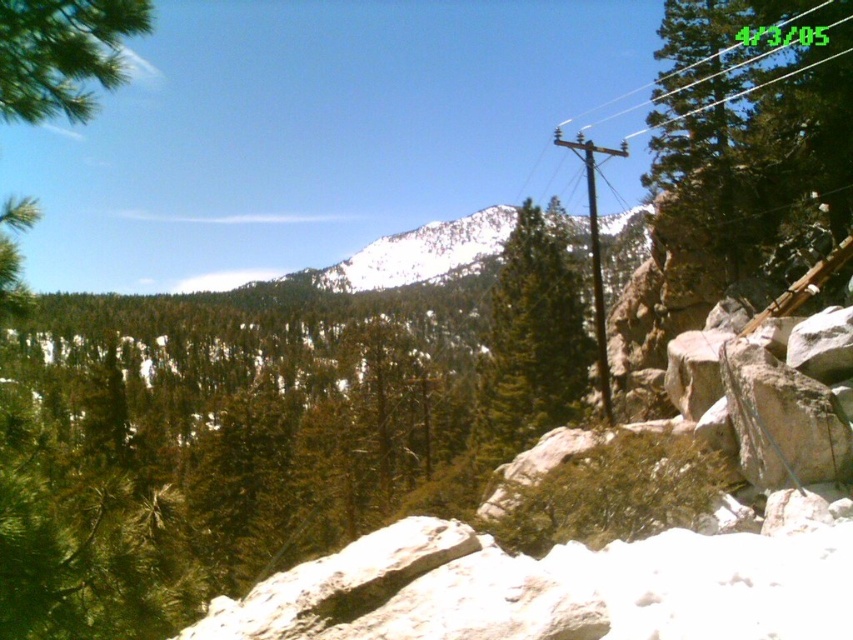
You are a bird looking for a place to perch. You see a green textured pine tree at center and a black plastic power line at upper right. Which object is shorter and better suited for landing?

The green textured pine tree at center is smaller than the black plastic power line at upper right, so it is shorter and better suited for landing.

You are standing at the base of the mountain and see the green textured pine tree at center. If you walk straight ahead, will you pass by the pine tree before reaching the utility pole with wires?

The green textured pine tree at center is located at point [531,346], which is centrally positioned in the scene. Since the utility pole with wires is situated to the right, walking straight ahead would lead you towards the center of the image first, passing the pine tree before reaching the utility pole with wires on the right.